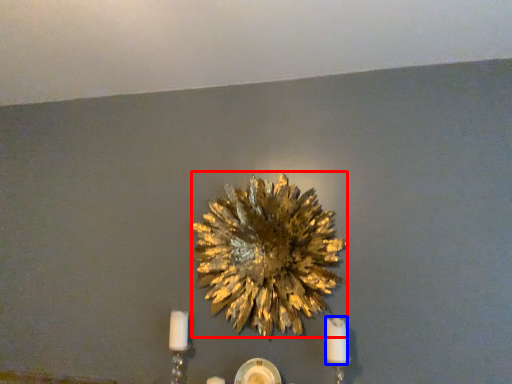
Question: Which object appears farthest to the camera in this image, flower (highlighted by a red box) or candle (highlighted by a blue box)?

Choices:
 (A) flower
 (B) candle

Answer: (A)